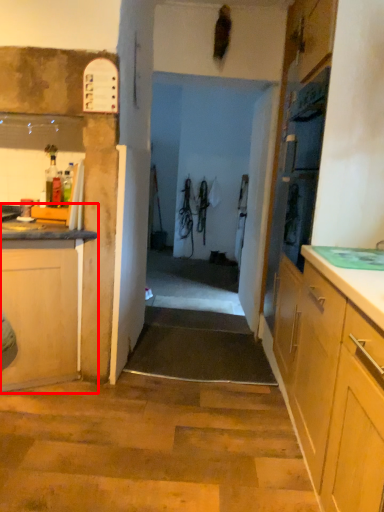
Question: From the image's perspective, considering the relative positions of cabinetry (annotated by the red box) and door in the image provided, where is cabinetry (annotated by the red box) located with respect to the staircase?

Choices:
 (A) below
 (B) above

Answer: (A)